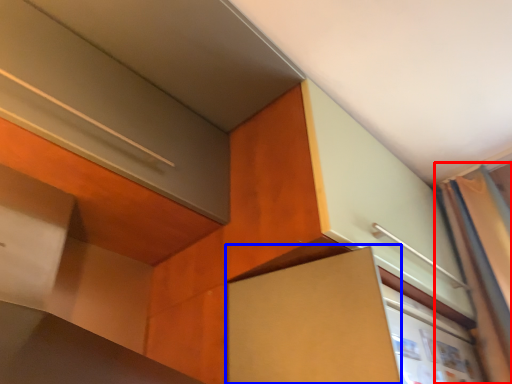
Question: Which point is closer to the camera, curtain (highlighted by a red box) or cabinetry (highlighted by a blue box)?

Choices:
 (A) curtain
 (B) cabinetry

Answer: (B)